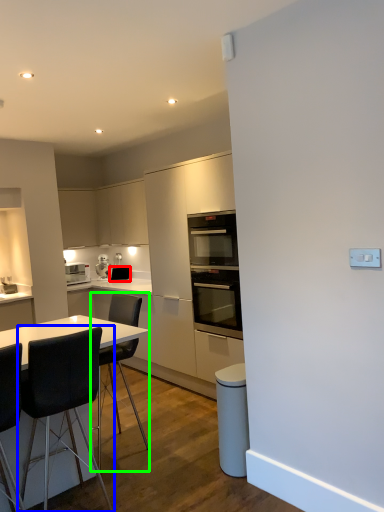
Question: Which object is the farthest from appliance (highlighted by a red box)? Choose among these: chair (highlighted by a blue box) or chair (highlighted by a green box).

Choices:
 (A) chair
 (B) chair

Answer: (A)